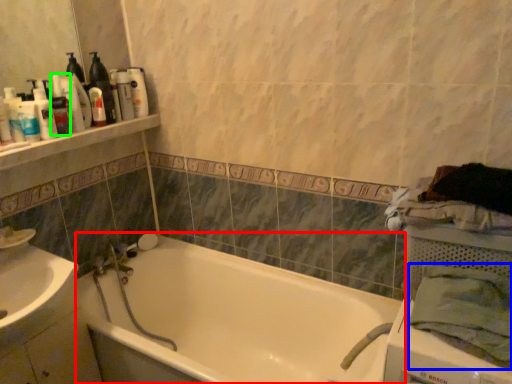
Question: Which object is positioned farthest from bathtub (highlighted by a red box)? Select from bath towel (highlighted by a blue box) and toiletry (highlighted by a green box).

Choices:
 (A) bath towel
 (B) toiletry

Answer: (B)